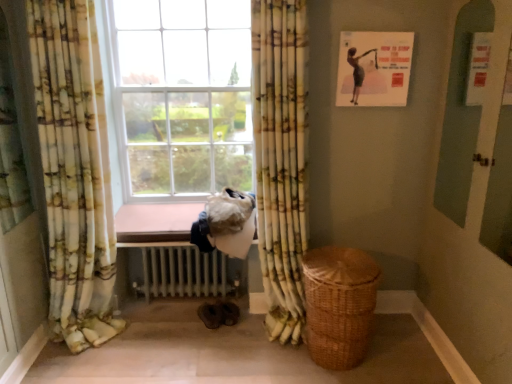
The image size is (512, 384). What do you see at coordinates (74, 170) in the screenshot? I see `floral fabric curtain at left, arranged as the second curtain when viewed from the right` at bounding box center [74, 170].

Describe the element at coordinates (156, 223) in the screenshot. Image resolution: width=512 pixels, height=384 pixels. I see `brown wooden window sill at center` at that location.

Describe the element at coordinates (182, 271) in the screenshot. I see `white metallic radiator at lower center` at that location.

Identify the location of floral fabric curtain at left, which appears as the 1th curtain when viewed from the left. (74, 170).

Based on their sizes in the image, would you say brown wooden window sill at center is bigger or smaller than yellow-green floral fabric curtain at center, which is the 2th curtain in left-to-right order?

Considering their sizes, brown wooden window sill at center takes up less space than yellow-green floral fabric curtain at center, which is the 2th curtain in left-to-right order.

Is there a large distance between brown wooden window sill at center and yellow-green floral fabric curtain at center, positioned as the first curtain in right-to-left order?

No.

Where is `window sill lying behind the yellow-green floral fabric curtain at center, positioned as the first curtain in right-to-left order`? The height and width of the screenshot is (384, 512). window sill lying behind the yellow-green floral fabric curtain at center, positioned as the first curtain in right-to-left order is located at coordinates (156, 223).

Is point (130, 240) less distant than point (302, 109)?

No.

The height and width of the screenshot is (384, 512). Identify the location of radiator behind the floral fabric curtain at left, which appears as the 1th curtain when viewed from the left. (182, 271).

Looking at their sizes, would you say floral fabric curtain at left, which appears as the 1th curtain when viewed from the left, is wider or thinner than white metallic radiator at lower center?

In the image, floral fabric curtain at left, which appears as the 1th curtain when viewed from the left, appears to be more narrow than white metallic radiator at lower center.

Considering the sizes of objects floral fabric curtain at left, arranged as the second curtain when viewed from the right, and white metallic radiator at lower center in the image provided, who is bigger, floral fabric curtain at left, arranged as the second curtain when viewed from the right, or white metallic radiator at lower center?

floral fabric curtain at left, arranged as the second curtain when viewed from the right.

Which object is further away from the camera, woven brown basket at lower right or floral fabric curtain at left, which appears as the 1th curtain when viewed from the left?

woven brown basket at lower right.

Is woven brown basket at lower right smaller than floral fabric curtain at left, which appears as the 1th curtain when viewed from the left?

Yes, woven brown basket at lower right is smaller than floral fabric curtain at left, which appears as the 1th curtain when viewed from the left.

From the image's perspective, relative to floral fabric curtain at left, arranged as the second curtain when viewed from the right, is woven brown basket at lower right above or below?

woven brown basket at lower right is situated lower than floral fabric curtain at left, arranged as the second curtain when viewed from the right, in the image.

Identify the location of basket that appears below the floral fabric curtain at left, arranged as the second curtain when viewed from the right (from the image's perspective). Image resolution: width=512 pixels, height=384 pixels. (339, 305).

Is brown wooden window sill at center spatially inside floral fabric curtain at left, which appears as the 1th curtain when viewed from the left, or outside of it?

brown wooden window sill at center is not inside floral fabric curtain at left, which appears as the 1th curtain when viewed from the left, it's outside.

From the image's perspective, is brown wooden window sill at center positioned above or below floral fabric curtain at left, which appears as the 1th curtain when viewed from the left?

brown wooden window sill at center is below floral fabric curtain at left, which appears as the 1th curtain when viewed from the left.

What's the angular difference between brown wooden window sill at center and floral fabric curtain at left, which appears as the 1th curtain when viewed from the left,'s facing directions?

The facing directions of brown wooden window sill at center and floral fabric curtain at left, which appears as the 1th curtain when viewed from the left, are 0.215 degrees apart.

Is point (177, 220) closer to camera compared to point (87, 179)?

That is False.

Locate an element on the screen. radiator below the floral fabric curtain at left, which appears as the 1th curtain when viewed from the left (from the image's perspective) is located at coordinates (182, 271).

Can floral fabric curtain at left, which appears as the 1th curtain when viewed from the left, be found inside white metallic radiator at lower center?

That's incorrect, floral fabric curtain at left, which appears as the 1th curtain when viewed from the left, is not inside white metallic radiator at lower center.

From the image's perspective, which is below, white metallic radiator at lower center or floral fabric curtain at left, arranged as the second curtain when viewed from the right?

white metallic radiator at lower center.

Considering the relative positions of white metallic radiator at lower center and floral fabric curtain at left, arranged as the second curtain when viewed from the right, in the image provided, is white metallic radiator at lower center to the left or to the right of floral fabric curtain at left, arranged as the second curtain when viewed from the right,?

From the image, it's evident that white metallic radiator at lower center is to the right of floral fabric curtain at left, arranged as the second curtain when viewed from the right.

Can we say floral fabric curtain at left, arranged as the second curtain when viewed from the right, lies outside brown wooden window sill at center?

Yes.

From the image's perspective, which object appears higher, floral fabric curtain at left, arranged as the second curtain when viewed from the right, or brown wooden window sill at center?

floral fabric curtain at left, arranged as the second curtain when viewed from the right, appears higher in the image.

Which object is more forward, floral fabric curtain at left, which appears as the 1th curtain when viewed from the left, or brown wooden window sill at center?

floral fabric curtain at left, which appears as the 1th curtain when viewed from the left.

In the scene shown: From the image's perspective, is yellow-green floral fabric curtain at center, which is the 2th curtain in left-to-right order, located above white metallic radiator at lower center?

Yes, from the image's perspective, yellow-green floral fabric curtain at center, which is the 2th curtain in left-to-right order, is on top of white metallic radiator at lower center.

Is point (269, 57) positioned after point (188, 277)?

No, it is not.

Would you say yellow-green floral fabric curtain at center, positioned as the first curtain in right-to-left order, is outside white metallic radiator at lower center?

Absolutely, yellow-green floral fabric curtain at center, positioned as the first curtain in right-to-left order, is external to white metallic radiator at lower center.

From a real-world perspective, does yellow-green floral fabric curtain at center, which is the 2th curtain in left-to-right order, sit lower than white metallic radiator at lower center?

No, from a real-world perspective, yellow-green floral fabric curtain at center, which is the 2th curtain in left-to-right order, is not beneath white metallic radiator at lower center.

Locate an element on the screen. The image size is (512, 384). curtain to the right of brown wooden window sill at center is located at coordinates (280, 158).

You are a GUI agent. You are given a task and a screenshot of the screen. Output one action in this format:
    pyautogui.click(x=<x>, y=<y>)
    Task: Click on the 2nd curtain in front of the white metallic radiator at lower center
    The width and height of the screenshot is (512, 384).
    Given the screenshot: What is the action you would take?
    74,170

Which object lies further to the anchor point white metallic radiator at lower center, woven brown basket at lower right or brown wooden window sill at center?

woven brown basket at lower right is further to white metallic radiator at lower center.

Considering their positions, is white metallic radiator at lower center positioned further to brown wooden window sill at center than woven brown basket at lower right?

The object further to brown wooden window sill at center is woven brown basket at lower right.

From the picture: When comparing their distances from yellow-green floral fabric curtain at center, which is the 2th curtain in left-to-right order, does floral fabric curtain at left, arranged as the second curtain when viewed from the right, or white metallic radiator at lower center seem closer?

white metallic radiator at lower center is positioned closer to the anchor yellow-green floral fabric curtain at center, which is the 2th curtain in left-to-right order.

Looking at the image, which one is located further to floral fabric curtain at left, which appears as the 1th curtain when viewed from the left, yellow-green floral fabric curtain at center, positioned as the first curtain in right-to-left order, or woven brown basket at lower right?

Based on the image, woven brown basket at lower right appears to be further to floral fabric curtain at left, which appears as the 1th curtain when viewed from the left.

Which object lies nearer to the anchor point white metallic radiator at lower center, yellow-green floral fabric curtain at center, which is the 2th curtain in left-to-right order, or brown wooden window sill at center?

Among the two, brown wooden window sill at center is located nearer to white metallic radiator at lower center.

Estimate the real-world distances between objects in this image. Which object is further from yellow-green floral fabric curtain at center, which is the 2th curtain in left-to-right order, floral fabric curtain at left, arranged as the second curtain when viewed from the right, or brown wooden window sill at center?

Based on the image, floral fabric curtain at left, arranged as the second curtain when viewed from the right, appears to be further to yellow-green floral fabric curtain at center, which is the 2th curtain in left-to-right order.

Looking at this image, when comparing their distances from woven brown basket at lower right, does brown wooden window sill at center or floral fabric curtain at left, arranged as the second curtain when viewed from the right, seem closer?

Among the two, brown wooden window sill at center is located nearer to woven brown basket at lower right.

Looking at this image, from the image, which object appears to be farther from white metallic radiator at lower center, yellow-green floral fabric curtain at center, positioned as the first curtain in right-to-left order, or woven brown basket at lower right?

Among the two, woven brown basket at lower right is located further to white metallic radiator at lower center.

Identify the location of window sill between yellow-green floral fabric curtain at center, which is the 2th curtain in left-to-right order, and white metallic radiator at lower center, along the z-axis. (156, 223).

Locate an element on the screen. Image resolution: width=512 pixels, height=384 pixels. window sill between floral fabric curtain at left, which appears as the 1th curtain when viewed from the left, and white metallic radiator at lower center, along the z-axis is located at coordinates (156, 223).

Locate an element on the screen. The height and width of the screenshot is (384, 512). curtain between floral fabric curtain at left, which appears as the 1th curtain when viewed from the left, and woven brown basket at lower right is located at coordinates (280, 158).

Locate an element on the screen. This screenshot has height=384, width=512. window sill located between white metallic radiator at lower center and woven brown basket at lower right in the left-right direction is located at coordinates (156, 223).